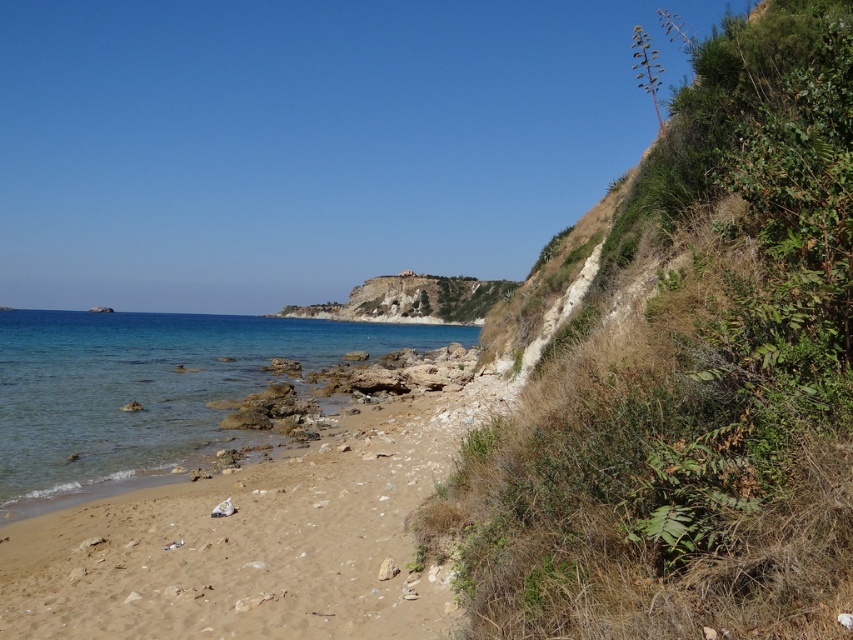
Based on the photo, between light brown sandy beach at lower center and clear blue water at lower left, which one has more height?

clear blue water at lower left is taller.

Between point (88, 588) and point (76, 376), which one is positioned in front?

Positioned in front is point (88, 588).

Between point (189, 628) and point (39, 416), which one is positioned in front?

Point (189, 628)

Locate an element on the screen. light brown sandy beach at lower center is located at coordinates (250, 545).